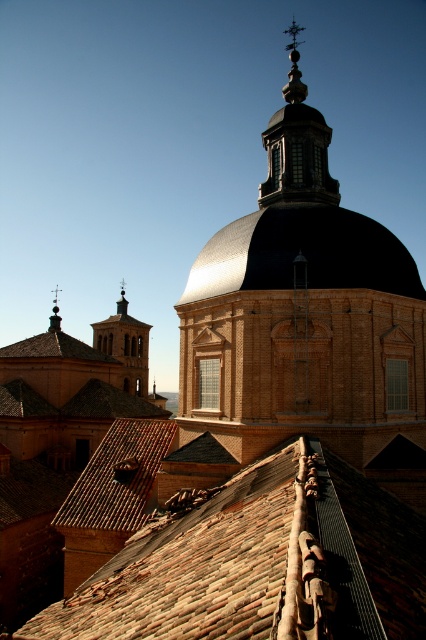
Is the position of brown clay tiles at center more distant than that of shiny metallic dome at center?

No, it is in front of shiny metallic dome at center.

Is brown clay tiles at center in front of shiny metallic dome at center?

Yes.

Is point (275, 560) farther from viewer compared to point (359, 259)?

No, (275, 560) is closer to viewer.

Find the location of a particular element. Image resolution: width=426 pixels, height=640 pixels. brown clay tiles at center is located at coordinates (259, 563).

Is the position of brick textured dome at center less distant than that of polished brass spire at upper left?

Yes.

Between brick textured dome at center and polished brass spire at upper left, which one is positioned higher?

brick textured dome at center

Which is in front, point (181, 365) or point (55, 314)?

Point (181, 365)

Where is `brick textured dome at center`? brick textured dome at center is located at coordinates (304, 314).

What do you see at coordinates (304, 314) in the screenshot? Image resolution: width=426 pixels, height=640 pixels. I see `brick textured dome at center` at bounding box center [304, 314].

Is brick textured dome at center bigger than brown clay tiles at center?

Yes.

Where is `brick textured dome at center`? Image resolution: width=426 pixels, height=640 pixels. brick textured dome at center is located at coordinates (304, 314).